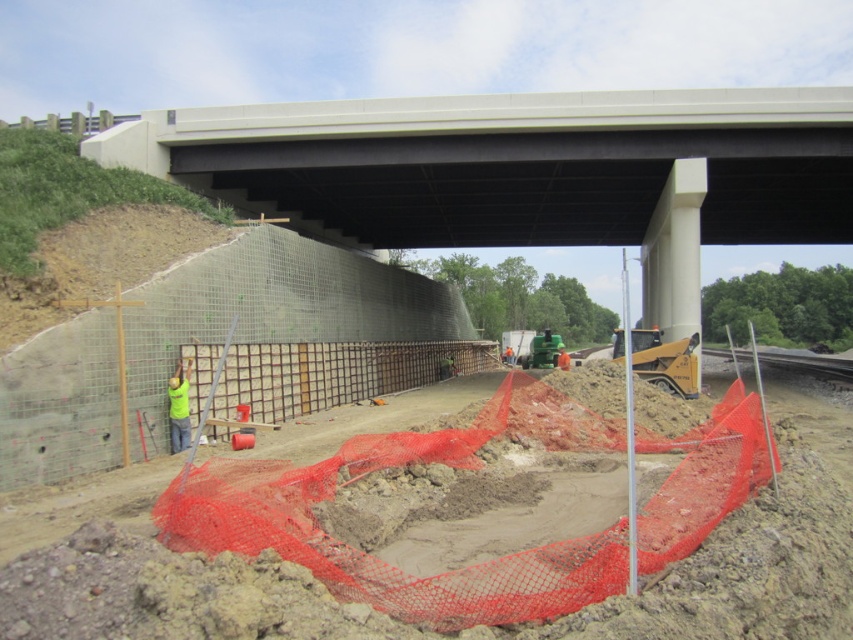
Looking at this image, you are a construction supervisor standing at the point marked by the coordinate point (807, 362). What object are you standing on?

You are standing on the gray concrete train track at lower right.

Looking at this image, you are a safety inspector at the construction site. You need to ensure that the yellow reflective vest at center is visible to workers on the gray concrete train track at lower right. Is the vest positioned above or below the train track?

The gray concrete train track at lower right is located below the yellow reflective vest at center, so the vest is positioned above the train track, making it visible to workers on the track.

You are a safety inspector at the construction site. You need to ensure that the yellow reflective vest at center is visible from the gray concrete train track at lower right. Considering their sizes, which object would be more noticeable from a distance?

The gray concrete train track at lower right is larger in size than the yellow reflective vest at center, so the gray concrete train track at lower right would be more noticeable from a distance.